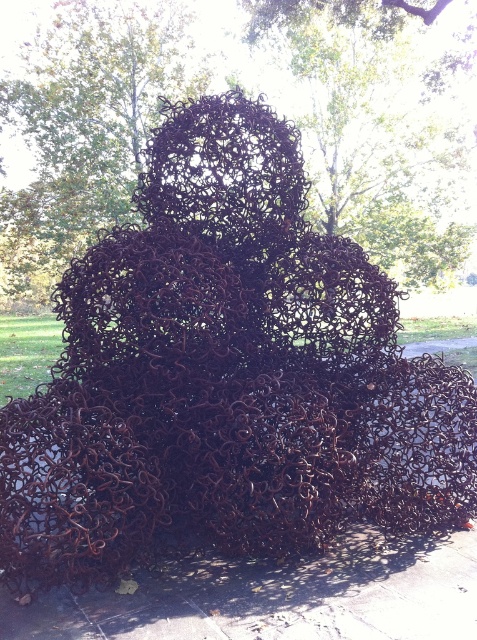
Question: Does rusty wire sculpture at center lie behind gray concrete pavement at lower center?

Choices:
 (A) yes
 (B) no

Answer: (A)

Question: Among these objects, which one is nearest to the camera?

Choices:
 (A) rusty wire sculpture at center
 (B) gray concrete pavement at lower center

Answer: (B)

Question: Which object appears farthest from the camera in this image?

Choices:
 (A) rusty wire sculpture at center
 (B) gray concrete pavement at lower center

Answer: (A)

Question: Is rusty wire sculpture at center smaller than gray concrete pavement at lower center?

Choices:
 (A) yes
 (B) no

Answer: (B)

Question: Can you confirm if rusty wire sculpture at center is positioned to the left of gray concrete pavement at lower center?

Choices:
 (A) yes
 (B) no

Answer: (A)